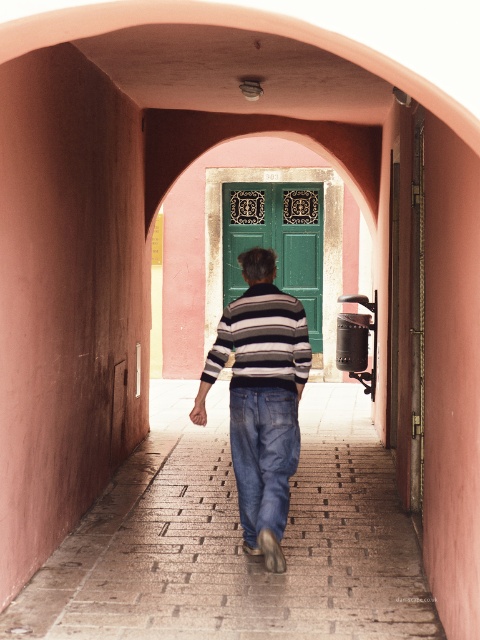
Does smooth stone path at center lie in front of denim at center?

Yes, smooth stone path at center is in front of denim at center.

Can you confirm if smooth stone path at center is smaller than denim at center?

Yes.

Is point (369, 595) closer to camera compared to point (279, 513)?

That is True.

Identify the location of smooth stone path at center. (236, 540).

In the scene shown: Does green painted wood door at center have a lesser height compared to striped cotton shirt at center?

No.

Identify the location of green painted wood door at center. (276, 241).

Is striped sweater at center positioned before green painted wood door at center?

Yes, striped sweater at center is in front of green painted wood door at center.

Does striped sweater at center appear on the right side of green painted wood door at center?

Incorrect, striped sweater at center is not on the right side of green painted wood door at center.

The image size is (480, 640). I want to click on striped sweater at center, so pyautogui.click(x=261, y=400).